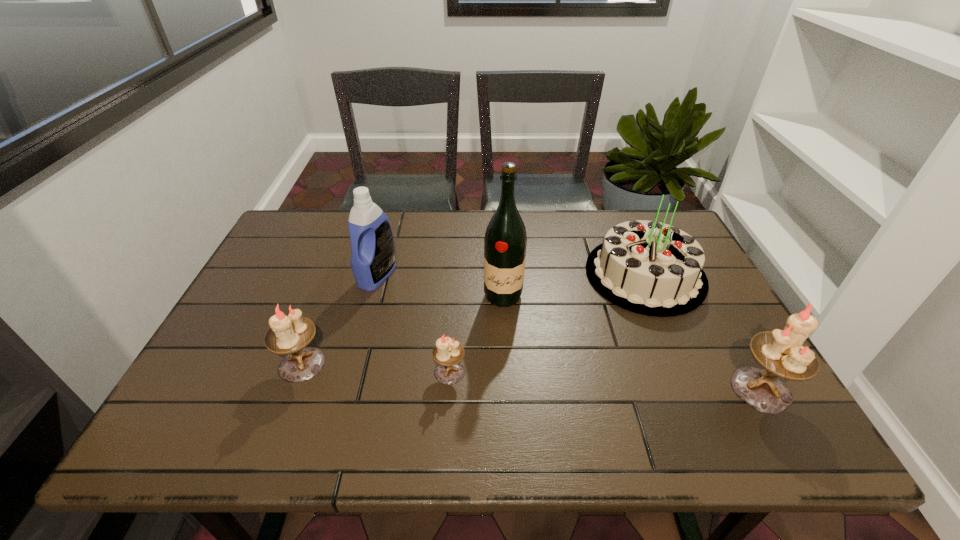
Image resolution: width=960 pixels, height=540 pixels. Identify the location of free space located 0.200m on the left of the shortest candle holder. (347, 372).

The width and height of the screenshot is (960, 540). I want to click on vacant point located on the left of the rightmost candle holder, so click(660, 389).

This screenshot has height=540, width=960. In order to click on free region located 0.150m on the front of the birthday cake in this screenshot , I will do `click(684, 364)`.

Image resolution: width=960 pixels, height=540 pixels. I want to click on free space located 0.280m on the front-facing side of the liquor, so click(x=509, y=401).

Find the location of a particular element. This screenshot has width=960, height=540. vacant region located on the front of the fifth object from right to left is located at coordinates (362, 334).

Locate an element on the screen. This screenshot has height=540, width=960. object that is at the far edge is located at coordinates (650, 268).

What are the coordinates of `candle holder that is at the right edge` in the screenshot? It's located at (782, 353).

Find the location of a particular element. The height and width of the screenshot is (540, 960). birthday cake situated at the right edge is located at coordinates (650, 268).

Where is `object that is at the far right corner`? This screenshot has height=540, width=960. object that is at the far right corner is located at coordinates (650, 268).

Locate an element on the screen. This screenshot has height=540, width=960. object present at the near right corner is located at coordinates [x=782, y=353].